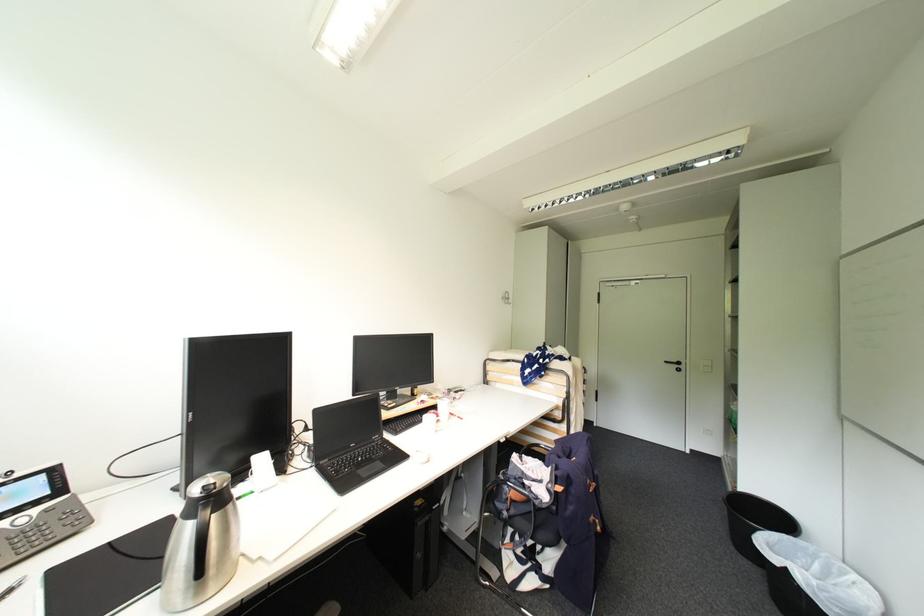
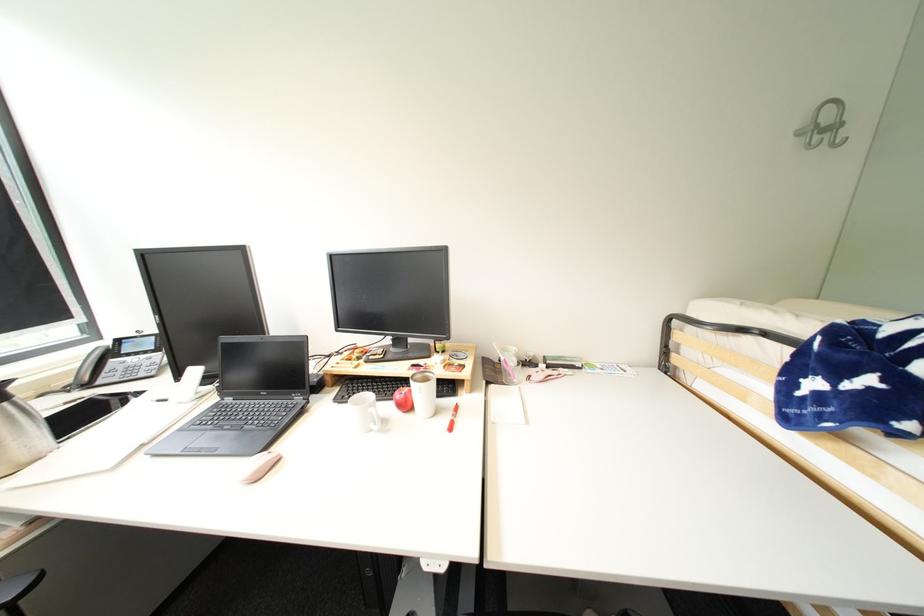
In the second image, find the point that corresponds to [515,300] in the first image.

(841, 128)